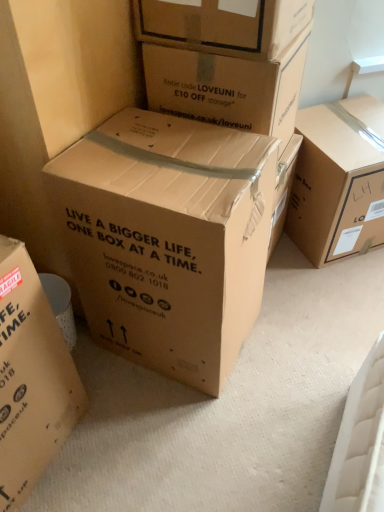
Question: Should I look upward or downward to see brown cardboard box at center, the 3th box viewed from the left?

Choices:
 (A) up
 (B) down

Answer: (A)

Question: Is brown cardboard box at center, which is the first box in left-to-right order, facing away from brown cardboard box at center, the 3th box viewed from the left?

Choices:
 (A) no
 (B) yes

Answer: (A)

Question: Is the position of brown cardboard box at center, which appears as the 6th box when viewed from the right, more distant than that of brown cardboard box at center, the fourth box viewed from the right?

Choices:
 (A) no
 (B) yes

Answer: (A)

Question: Is brown cardboard box at center, which is the first box in left-to-right order, wider than brown cardboard box at center, the fourth box viewed from the right?

Choices:
 (A) no
 (B) yes

Answer: (A)

Question: From a real-world perspective, is brown cardboard box at center, which is the first box in left-to-right order, over brown cardboard box at center, the 3th box viewed from the left?

Choices:
 (A) no
 (B) yes

Answer: (B)

Question: Does brown cardboard box at center, which appears as the 6th box when viewed from the right, appear on the right side of brown cardboard box at center, the 3th box viewed from the left?

Choices:
 (A) yes
 (B) no

Answer: (B)

Question: From the image's perspective, is brown cardboard box at center, which is the first box in left-to-right order, located beneath brown cardboard box at center, the fourth box viewed from the right?

Choices:
 (A) yes
 (B) no

Answer: (A)

Question: Is brown cardboard box at center, the 3th box viewed from the left, oriented away from brown cardboard box at center, which appears as the 6th box when viewed from the right?

Choices:
 (A) no
 (B) yes

Answer: (A)

Question: Can you confirm if brown cardboard box at center, the 3th box viewed from the left, is bigger than brown cardboard box at center, which appears as the 6th box when viewed from the right?

Choices:
 (A) no
 (B) yes

Answer: (B)

Question: From a real-world perspective, is brown cardboard box at center, the 3th box viewed from the left, beneath brown cardboard box at center, which is the first box in left-to-right order?

Choices:
 (A) yes
 (B) no

Answer: (A)

Question: From the image's perspective, is brown cardboard box at center, the fourth box viewed from the right, above brown cardboard box at center, which appears as the 6th box when viewed from the right?

Choices:
 (A) yes
 (B) no

Answer: (A)

Question: Is brown cardboard box at center, the fourth box viewed from the right, directly adjacent to brown cardboard box at center, which is the first box in left-to-right order?

Choices:
 (A) yes
 (B) no

Answer: (B)

Question: Considering the relative positions of brown cardboard box at center, the 3th box viewed from the left, and brown cardboard box at center, which appears as the 6th box when viewed from the right, in the image provided, is brown cardboard box at center, the 3th box viewed from the left, behind brown cardboard box at center, which appears as the 6th box when viewed from the right,?

Choices:
 (A) yes
 (B) no

Answer: (A)

Question: Does brown cardboard box at upper right, acting as the first box starting from the right, have a greater height compared to brown cardboard box at center, the 3th box viewed from the left?

Choices:
 (A) no
 (B) yes

Answer: (A)